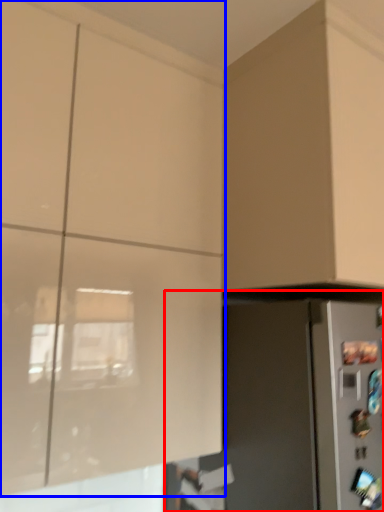
Question: Among these objects, which one is nearest to the camera, appliance (highlighted by a red box) or cabinetry (highlighted by a blue box)?

Choices:
 (A) appliance
 (B) cabinetry

Answer: (B)